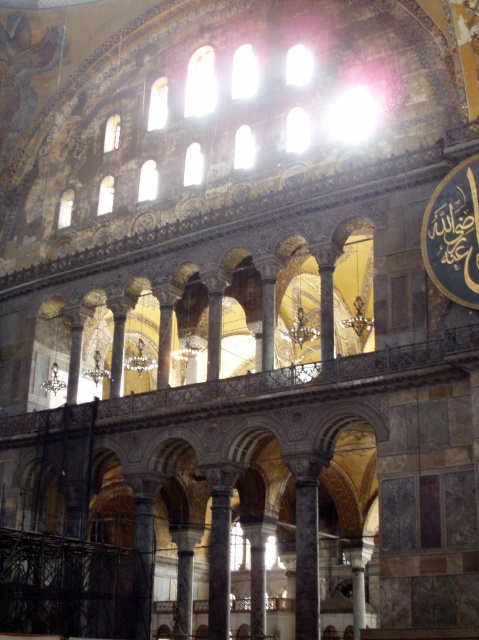
Is gold metallic clock at upper right closer to camera compared to polished marble column at center?

Yes, gold metallic clock at upper right is in front of polished marble column at center.

Can you confirm if gold metallic clock at upper right is bigger than polished marble column at center?

Correct, gold metallic clock at upper right is larger in size than polished marble column at center.

Is point (471, 243) closer to viewer compared to point (213, 552)?

Yes, it is.

Find the location of a particular element. This screenshot has height=640, width=479. gold metallic clock at upper right is located at coordinates (454, 234).

Does gold metallic clock at upper right appear on the left side of black marble column at center?

No, gold metallic clock at upper right is not to the left of black marble column at center.

Who is more forward, (462, 240) or (316, 564)?

Point (462, 240)

Find the location of `gold metallic clock at upper right`. gold metallic clock at upper right is located at coordinates (454, 234).

What are the coordinates of `gold metallic clock at upper right` in the screenshot? It's located at (454, 234).

Is point (307, 572) closer to camera compared to point (223, 515)?

Yes, point (307, 572) is in front of point (223, 515).

Who is higher up, black marble column at center or polished marble column at center?

Positioned higher is black marble column at center.

At what (x,y) coordinates should I click in order to perform the action: click on black marble column at center. Please return your answer as a coordinate pair (x, y). Looking at the image, I should click on (307, 560).